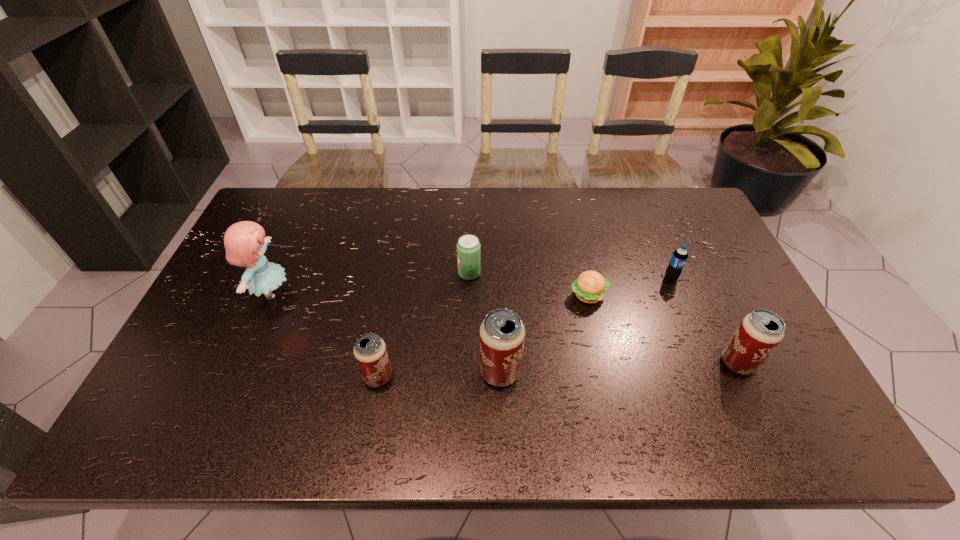
Locate an element on the screen. object present at the near right corner is located at coordinates (759, 333).

In the image, there is a desktop. Where is `vacant space at the far edge`? This screenshot has height=540, width=960. vacant space at the far edge is located at coordinates (431, 192).

Where is `free space at the near edge of the desktop`? This screenshot has height=540, width=960. free space at the near edge of the desktop is located at coordinates (588, 379).

Locate an element on the screen. vacant space at the left edge is located at coordinates (260, 313).

The height and width of the screenshot is (540, 960). Find the location of `free space at the right edge of the desktop`. free space at the right edge of the desktop is located at coordinates (707, 273).

At what (x,y) coordinates should I click in order to perform the action: click on free space at the far left corner of the desktop. Please return your answer as a coordinate pair (x, y). This screenshot has height=540, width=960. Looking at the image, I should click on 312,188.

You are a GUI agent. You are given a task and a screenshot of the screen. Output one action in this format:
    pyautogui.click(x=<x>, y=<y>)
    Task: Click on the vacant space at the far right corner of the desktop
    
    Given the screenshot: What is the action you would take?
    pyautogui.click(x=681, y=225)

You are a GUI agent. You are given a task and a screenshot of the screen. Output one action in this format:
    pyautogui.click(x=<x>, y=<y>)
    Task: Click on the vacant space at the near right corner of the desktop
    
    Given the screenshot: What is the action you would take?
    pyautogui.click(x=738, y=380)

Where is `vacant area that lies between the tallest object and the second beer can from right to left`? vacant area that lies between the tallest object and the second beer can from right to left is located at coordinates (386, 332).

Image resolution: width=960 pixels, height=540 pixels. What are the coordinates of `unoccupied position between the second tallest beer can and the second beer can from right to left` in the screenshot? It's located at (619, 368).